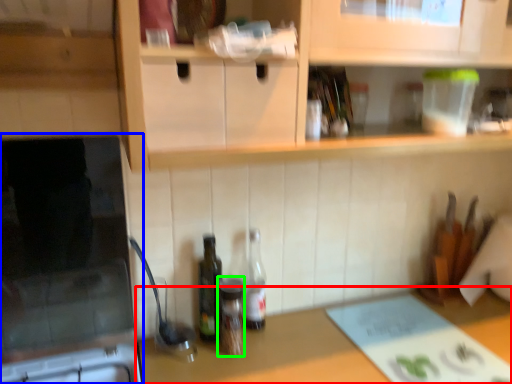
Question: Based on their relative distances, which object is farther from countertop (highlighted by a red box)? Choose from appliance (highlighted by a blue box) and bottle (highlighted by a green box).

Choices:
 (A) appliance
 (B) bottle

Answer: (A)